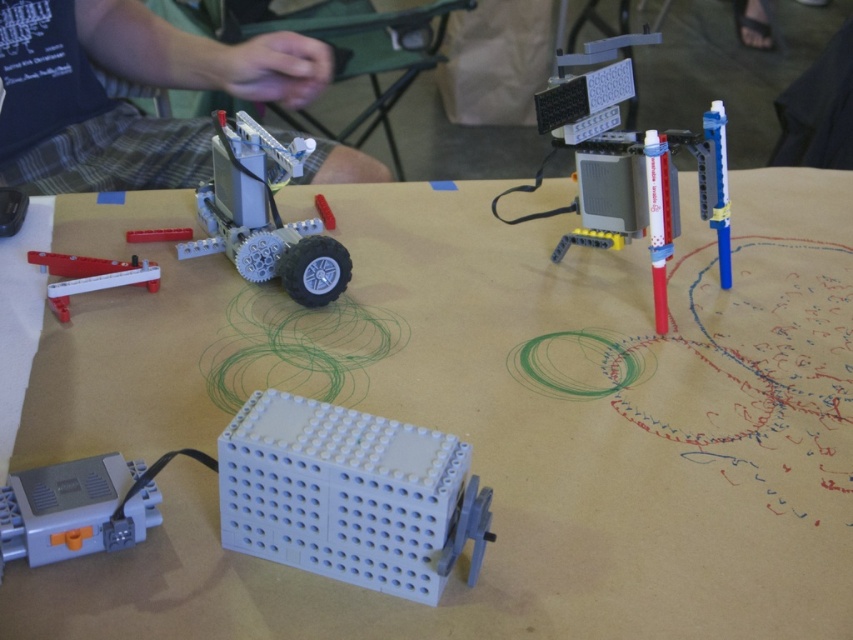
Can you confirm if matte plastic rover at center-left is wider than white plastic lever at left?

Correct, the width of matte plastic rover at center-left exceeds that of white plastic lever at left.

Is matte plastic rover at center-left shorter than white plastic lever at left?

In fact, matte plastic rover at center-left may be taller than white plastic lever at left.

Identify the location of matte plastic rover at center-left. (264, 216).

Measure the distance between point (x=51, y=445) and camera.

Point (x=51, y=445) is 16.58 inches from camera.

Where is `white plastic table at center`? This screenshot has height=640, width=853. white plastic table at center is located at coordinates (492, 422).

Is point (218, 625) closer to viewer compared to point (352, 540)?

Yes, it is in front of point (352, 540).

In order to click on white plastic table at center in this screenshot , I will do `click(492, 422)`.

Between translucent red pen at upper right and matte plastic rover at center-left, which one has less height?

matte plastic rover at center-left is shorter.

Does point (560, 108) lie in front of point (334, 291)?

Yes, it is in front of point (334, 291).

Locate an element on the screen. This screenshot has width=853, height=640. translucent red pen at upper right is located at coordinates (627, 164).